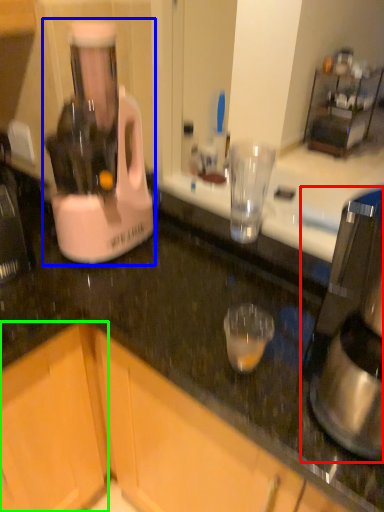
Question: Which is farther away from coffee maker (highlighted by a red box)? blender (highlighted by a blue box) or cabinetry (highlighted by a green box)?

Choices:
 (A) blender
 (B) cabinetry

Answer: (B)